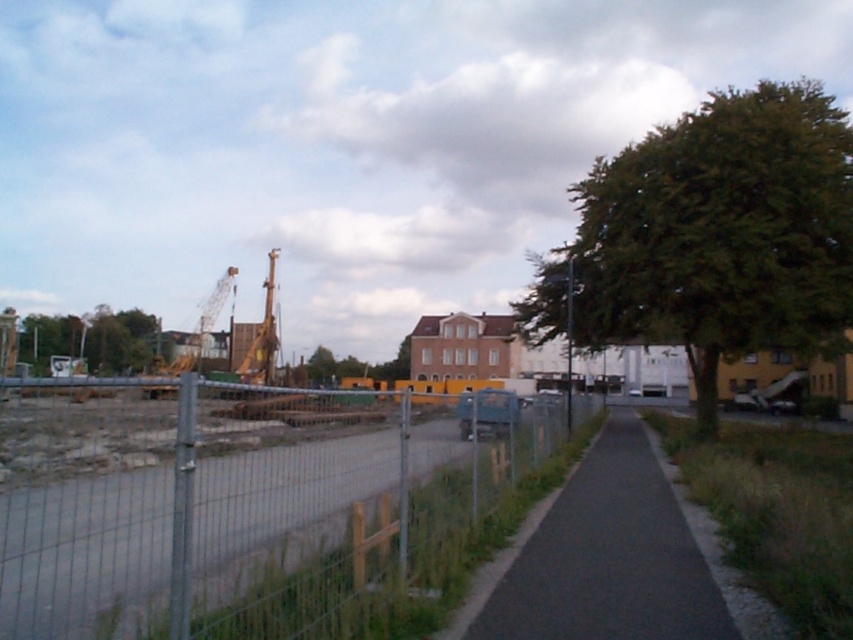
Who is lower down, green leafy tree at right or yellow metallic crane at center-left?

Positioned lower is yellow metallic crane at center-left.

Is green leafy tree at right closer to camera compared to yellow metallic crane at center-left?

Yes.

Find the location of a particular element. The image size is (853, 640). green leafy tree at right is located at coordinates tap(712, 236).

Can you confirm if black asphalt pavement at center is positioned below green leafy tree at left?

Correct, black asphalt pavement at center is located below green leafy tree at left.

Which is behind, point (695, 602) or point (154, 356)?

The point (154, 356) is behind.

This screenshot has height=640, width=853. In order to click on black asphalt pavement at center in this screenshot , I will do `click(606, 556)`.

In the scene shown: Can you confirm if green leafy tree at center is shorter than yellow metallic crane at left?

Yes.

Between green leafy tree at center and yellow metallic crane at left, which one is positioned higher?

yellow metallic crane at left

Measure the distance between point (326, 374) and camera.

90.34 meters

What are the coordinates of `green leafy tree at center` in the screenshot? It's located at (355, 365).